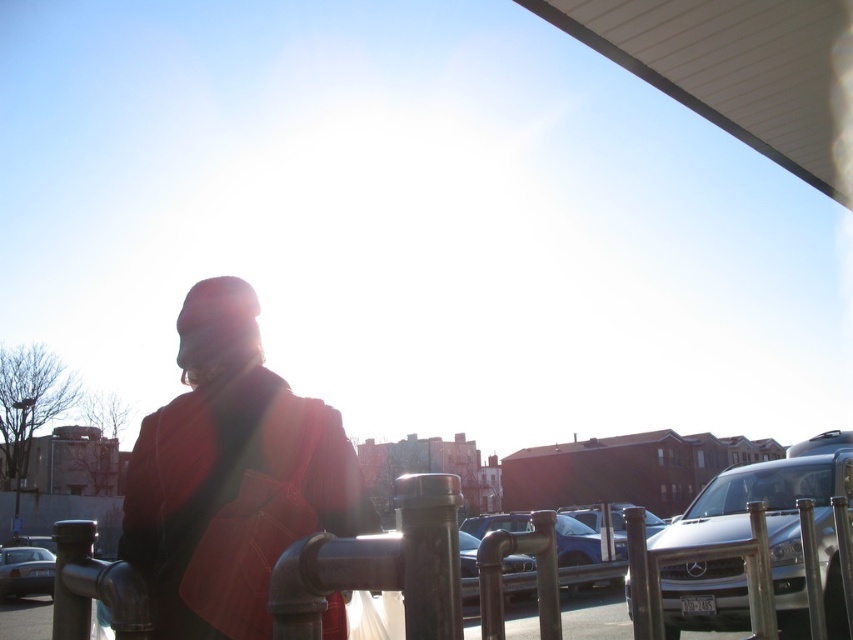
In the scene shown: Between silver metallic suv at lower right and silver metallic car at lower left, which one is positioned lower?

silver metallic car at lower left is lower down.

Measure the distance between silver metallic suv at lower right and camera.

silver metallic suv at lower right is 3.37 meters from camera.

Locate an element on the screen. The image size is (853, 640). silver metallic suv at lower right is located at coordinates (780, 522).

Locate an element on the screen. The image size is (853, 640). silver metallic suv at lower right is located at coordinates (780, 522).

What are the coordinates of `matte red coat at center` in the screenshot? It's located at click(231, 476).

From the picture: Is matte red coat at center above silver metallic suv at lower right?

A: Indeed, matte red coat at center is positioned over silver metallic suv at lower right.

Which is in front, point (242, 392) or point (827, 561)?

Point (242, 392) is in front.

Locate an element on the screen. matte red coat at center is located at coordinates (231, 476).

Where is `matte red coat at center`? This screenshot has height=640, width=853. matte red coat at center is located at coordinates (231, 476).